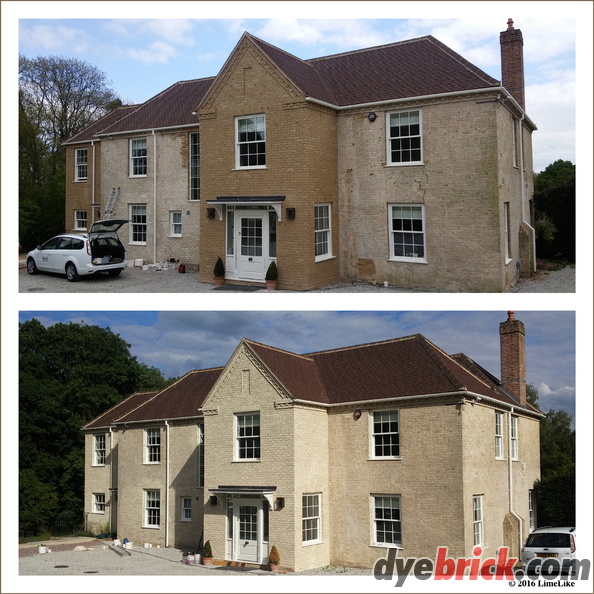
Locate an element on the screen. Image resolution: width=594 pixels, height=594 pixels. ladder is located at coordinates (110, 200).